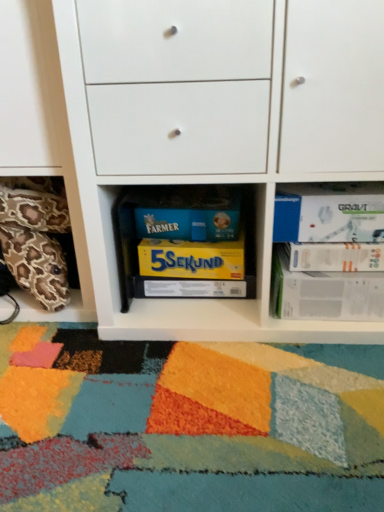
Question: Is yellow matte board game at center, which is counted as the third paperback book, starting from the top, surrounding white matte cabinet at center?

Choices:
 (A) yes
 (B) no

Answer: (B)

Question: Is yellow matte board game at center, which is counted as the third paperback book, starting from the top, further to the viewer compared to white matte cabinet at center?

Choices:
 (A) yes
 (B) no

Answer: (A)

Question: From a real-world perspective, is yellow matte board game at center, which is counted as the third paperback book, starting from the top, on top of white matte cabinet at center?

Choices:
 (A) no
 (B) yes

Answer: (A)

Question: Is white matte cabinet at center at the back of yellow matte board game at center, the third paperback book ordered from the bottom?

Choices:
 (A) yes
 (B) no

Answer: (A)

Question: Does yellow matte board game at center, the third paperback book ordered from the bottom, appear on the right side of white matte cabinet at center?

Choices:
 (A) yes
 (B) no

Answer: (B)

Question: Does yellow matte board game at center, which is counted as the third paperback book, starting from the top, have a smaller size compared to white matte cabinet at center?

Choices:
 (A) no
 (B) yes

Answer: (B)

Question: Is yellow matte board game at center, the third paperback book ordered from the bottom, surrounded by leopard print pillow at lower left?

Choices:
 (A) yes
 (B) no

Answer: (B)

Question: Considering the relative positions of leopard print pillow at lower left and yellow matte board game at center, the third paperback book ordered from the bottom, in the image provided, is leopard print pillow at lower left to the left of yellow matte board game at center, the third paperback book ordered from the bottom, from the viewer's perspective?

Choices:
 (A) yes
 (B) no

Answer: (A)

Question: Is leopard print pillow at lower left wider than yellow matte board game at center, which is counted as the third paperback book, starting from the top?

Choices:
 (A) yes
 (B) no

Answer: (A)

Question: Is leopard print pillow at lower left shorter than yellow matte board game at center, the third paperback book ordered from the bottom?

Choices:
 (A) yes
 (B) no

Answer: (B)

Question: Does leopard print pillow at lower left have a lesser width compared to yellow matte board game at center, which is counted as the third paperback book, starting from the top?

Choices:
 (A) yes
 (B) no

Answer: (B)

Question: Is leopard print pillow at lower left closer to the viewer compared to yellow matte board game at center, the third paperback book ordered from the bottom?

Choices:
 (A) no
 (B) yes

Answer: (B)

Question: Considering the relative positions of white matte paperback book at upper right, marked as the fifth paperback book in a bottom-to-top arrangement, and white matte cabinet at center in the image provided, is white matte paperback book at upper right, marked as the fifth paperback book in a bottom-to-top arrangement, to the right of white matte cabinet at center from the viewer's perspective?

Choices:
 (A) no
 (B) yes

Answer: (B)